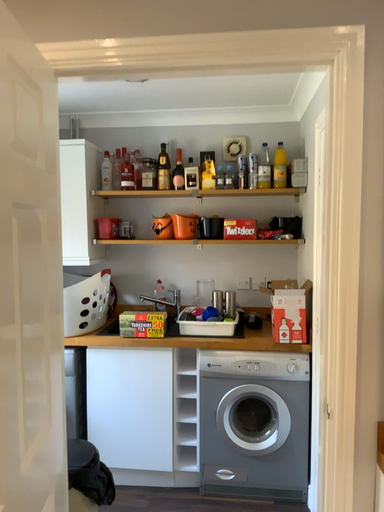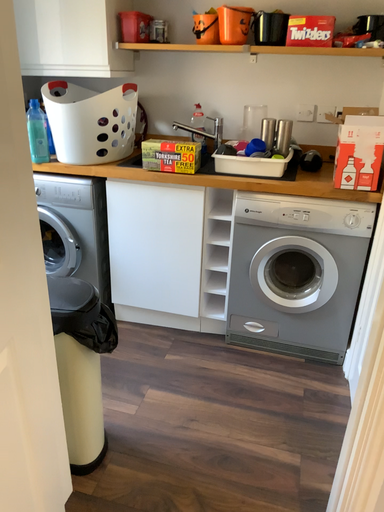
Question: How did the camera likely rotate when shooting the video?

Choices:
 (A) rotated right
 (B) rotated left

Answer: (B)